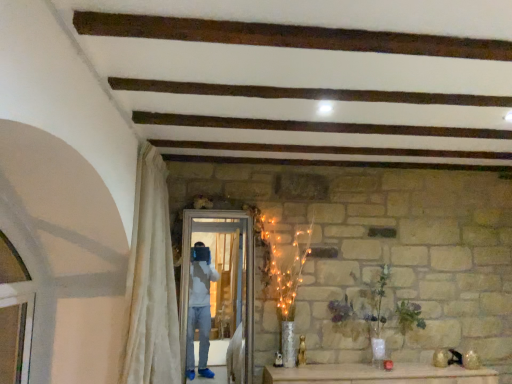
Identify the location of white sheer curtain at left. This screenshot has height=384, width=512. tap(151, 281).

Image resolution: width=512 pixels, height=384 pixels. I want to click on white glossy screen door at center, so click(x=218, y=288).

Looking at their sizes, would you say green matte vase at center is wider or thinner than white glossy screen door at center?

In the image, green matte vase at center appears to be wider than white glossy screen door at center.

The image size is (512, 384). I want to click on screen door above the green matte vase at center (from a real-world perspective), so click(218, 288).

Does point (403, 306) lie in front of point (199, 338)?

No, (403, 306) is behind (199, 338).

Would you say white sheer curtain at left is outside white glossy screen door at center?

Yes, white sheer curtain at left is not within white glossy screen door at center.

What's the angular difference between white sheer curtain at left and white glossy screen door at center's facing directions?

They differ by 88.4 degrees in their facing directions.

Can you confirm if white sheer curtain at left is taller than white glossy screen door at center?

Indeed, white sheer curtain at left has a greater height compared to white glossy screen door at center.

Where is `screen door directly beneath the white sheer curtain at left (from a real-world perspective)`? This screenshot has width=512, height=384. screen door directly beneath the white sheer curtain at left (from a real-world perspective) is located at coordinates (218, 288).

Looking at this image, considering the sizes of objects green matte vase at center and white sheer curtain at left in the image provided, who is bigger, green matte vase at center or white sheer curtain at left?

Bigger between the two is white sheer curtain at left.

Could you tell me if green matte vase at center is turned towards white sheer curtain at left?

No, green matte vase at center is not turned towards white sheer curtain at left.

Is green matte vase at center surrounding white sheer curtain at left?

That's incorrect, white sheer curtain at left is not inside green matte vase at center.

Is point (360, 298) farther from camera compared to point (141, 333)?

Yes, it is.

From the image's perspective, would you say white glossy screen door at center is shown under green matte vase at center?

No, from the image's perspective, white glossy screen door at center is not below green matte vase at center.

In the image, there is a green matte vase at center. Identify the location of screen door above it (from the image's perspective). (218, 288).

Looking at this image, does white glossy screen door at center have a lesser width compared to green matte vase at center?

Yes.

Is white glossy screen door at center placed right next to green matte vase at center?

No, white glossy screen door at center is not touching green matte vase at center.

Is white sheer curtain at left far from green matte vase at center?

white sheer curtain at left is positioned a significant distance from green matte vase at center.

Is white sheer curtain at left oriented away from green matte vase at center?

No, green matte vase at center is not at the back of white sheer curtain at left.

Which of these two, white sheer curtain at left or green matte vase at center, is smaller?

green matte vase at center is smaller.

This screenshot has height=384, width=512. What are the coordinates of `curtain that appears in front of the green matte vase at center` in the screenshot? It's located at (151, 281).

Is point (222, 255) in front of point (174, 299)?

No, it is behind (174, 299).

Does white glossy screen door at center appear on the left side of white sheer curtain at left?

In fact, white glossy screen door at center is to the right of white sheer curtain at left.

Based on the photo, which of these two, white glossy screen door at center or white sheer curtain at left, stands taller?

Standing taller between the two is white sheer curtain at left.

Is there a large distance between white glossy screen door at center and white sheer curtain at left?

white glossy screen door at center is actually quite close to white sheer curtain at left.

The height and width of the screenshot is (384, 512). Find the location of `screen door located above the green matte vase at center (from the image's perspective)`. screen door located above the green matte vase at center (from the image's perspective) is located at coordinates (218, 288).

You are a GUI agent. You are given a task and a screenshot of the screen. Output one action in this format:
    pyautogui.click(x=<x>, y=<y>)
    Task: Click on the screen door below the white sheer curtain at left (from a real-world perspective)
    The width and height of the screenshot is (512, 384).
    Given the screenshot: What is the action you would take?
    pyautogui.click(x=218, y=288)

Looking at the image, which one is located closer to white glossy screen door at center, white sheer curtain at left or green matte vase at center?

white sheer curtain at left is positioned closer to the anchor white glossy screen door at center.

Based on their spatial positions, is white glossy screen door at center or green matte vase at center closer to white sheer curtain at left?

white glossy screen door at center.

In the scene shown: Considering their positions, is green matte vase at center positioned further to white glossy screen door at center than white sheer curtain at left?

Based on the image, green matte vase at center appears to be further to white glossy screen door at center.

Looking at the image, which one is located closer to white sheer curtain at left, green matte vase at center or white glossy screen door at center?

white glossy screen door at center lies closer to white sheer curtain at left than the other object.

Based on their spatial positions, is white sheer curtain at left or white glossy screen door at center closer to green matte vase at center?

white glossy screen door at center.

When comparing their distances from green matte vase at center, does white glossy screen door at center or white sheer curtain at left seem closer?

white glossy screen door at center lies closer to green matte vase at center than the other object.

I want to click on screen door between white sheer curtain at left and green matte vase at center in the horizontal direction, so click(x=218, y=288).